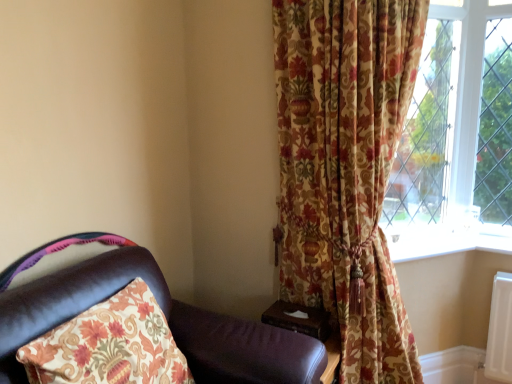
What do you see at coordinates (298, 319) in the screenshot?
I see `wooden at right` at bounding box center [298, 319].

From the picture: Measure the distance between point (318, 148) and camera.

Point (318, 148) and camera are 5.94 feet apart.

Locate an element on the screen. leather chair at left is located at coordinates (162, 309).

Where is `wooden at right`? This screenshot has width=512, height=384. wooden at right is located at coordinates (298, 319).

From the image's perspective, is floral fabric curtain at right positioned above or below wooden at right?

floral fabric curtain at right is situated higher than wooden at right in the image.

Is point (327, 173) farther from viewer compared to point (313, 336)?

Yes.

Would you say floral fabric curtain at right is inside or outside wooden at right?

floral fabric curtain at right cannot be found inside wooden at right.

Can you confirm if floral fabric curtain at right is wider than wooden at right?

Yes, floral fabric curtain at right is wider than wooden at right.

At what (x,y) coordinates should I click in order to perform the action: click on chair below the floral fabric curtain at right (from the image's perspective). Please return your answer as a coordinate pair (x, y). This screenshot has height=384, width=512. Looking at the image, I should click on (162, 309).

Is leather chair at left thinner than floral fabric curtain at right?

In fact, leather chair at left might be wider than floral fabric curtain at right.

Which of these two, leather chair at left or floral fabric curtain at right, stands taller?

Standing taller between the two is floral fabric curtain at right.

Is leather chair at left completely or partially outside of floral fabric curtain at right?

leather chair at left is positioned outside floral fabric curtain at right.

Is point (321, 338) farther from viewer compared to point (388, 238)?

No, it is not.

Would you say wooden at right is inside or outside white plastic window sill at lower right?

wooden at right exists outside the volume of white plastic window sill at lower right.

Is there a large distance between wooden at right and white plastic window sill at lower right?

No, wooden at right is in close proximity to white plastic window sill at lower right.

Which is behind, point (480, 246) or point (187, 304)?

Point (480, 246)

Is white plastic window sill at lower right in contact with leather chair at left?

No, white plastic window sill at lower right is not in contact with leather chair at left.

Based on the photo, considering the relative sizes of white plastic window sill at lower right and leather chair at left in the image provided, is white plastic window sill at lower right taller than leather chair at left?

In fact, white plastic window sill at lower right may be shorter than leather chair at left.

Is white plastic window sill at lower right positioned behind leather chair at left?

Yes, white plastic window sill at lower right is further from the camera.

What's the angular difference between leather chair at left and white plastic window sill at lower right's facing directions?

leather chair at left and white plastic window sill at lower right are facing 40.3 degrees away from each other.

Is there a large distance between leather chair at left and white plastic window sill at lower right?

leather chair at left is positioned a significant distance from white plastic window sill at lower right.

This screenshot has width=512, height=384. In order to click on window sill above the leather chair at left (from a real-world perspective) in this screenshot , I will do `click(444, 242)`.

In the image, is leather chair at left on the left side or the right side of white plastic window sill at lower right?

leather chair at left is to the left of white plastic window sill at lower right.

From the image's perspective, which is above, floral fabric curtain at right or white plastic window sill at lower right?

floral fabric curtain at right is shown above in the image.

Which of these two, floral fabric curtain at right or white plastic window sill at lower right, is thinner?

Thinner between the two is white plastic window sill at lower right.

Between floral fabric curtain at right and white plastic window sill at lower right, which one appears on the right side from the viewer's perspective?

From the viewer's perspective, white plastic window sill at lower right appears more on the right side.

In order to click on window sill located underneath the floral fabric curtain at right (from a real-world perspective) in this screenshot , I will do `click(444, 242)`.

Are white plastic window sill at lower right and wooden at right located far from each other?

white plastic window sill at lower right is near wooden at right, not far away.

In the scene shown: Does white plastic window sill at lower right appear on the left side of wooden at right?

No.

Which point is more distant from viewer, (420, 237) or (298, 313)?

The point (420, 237) is farther.

Which of these two, white plastic window sill at lower right or wooden at right, stands taller?

Standing taller between the two is wooden at right.

In the image, there is a floral fabric curtain at right. Identify the location of table below it (from a real-world perspective). This screenshot has height=384, width=512. (298, 319).

At what (x,y) coordinates should I click in order to perform the action: click on curtain that is on the right side of leather chair at left. Please return your answer as a coordinate pair (x, y). Looking at the image, I should click on (345, 169).

From the picture: Based on their spatial positions, is white plastic window sill at lower right or leather chair at left closer to wooden at right?

Among the two, leather chair at left is located nearer to wooden at right.

From the image, which object appears to be nearer to wooden at right, floral fabric curtain at right or leather chair at left?

The object closer to wooden at right is leather chair at left.

From the image, which object appears to be nearer to floral fabric curtain at right, leather chair at left or white plastic window sill at lower right?

white plastic window sill at lower right lies closer to floral fabric curtain at right than the other object.

Looking at the image, which one is located closer to floral fabric curtain at right, leather chair at left or wooden at right?

wooden at right lies closer to floral fabric curtain at right than the other object.

Based on their spatial positions, is wooden at right or floral fabric curtain at right closer to white plastic window sill at lower right?

floral fabric curtain at right is positioned closer to the anchor white plastic window sill at lower right.

Considering their positions, is floral fabric curtain at right positioned further to leather chair at left than white plastic window sill at lower right?

The object further to leather chair at left is white plastic window sill at lower right.

Considering their positions, is leather chair at left positioned further to white plastic window sill at lower right than wooden at right?

leather chair at left lies further to white plastic window sill at lower right than the other object.

Which object lies nearer to the anchor point wooden at right, leather chair at left or floral fabric curtain at right?

leather chair at left.

This screenshot has width=512, height=384. Find the location of `curtain between leather chair at left and wooden at right from front to back`. curtain between leather chair at left and wooden at right from front to back is located at coordinates (345, 169).

Find the location of `table located between leather chair at left and white plastic window sill at lower right in the depth direction`. table located between leather chair at left and white plastic window sill at lower right in the depth direction is located at coordinates (298, 319).

This screenshot has width=512, height=384. I want to click on curtain between leather chair at left and white plastic window sill at lower right, so click(345, 169).

In order to click on curtain situated between wooden at right and white plastic window sill at lower right from left to right in this screenshot , I will do `click(345, 169)`.